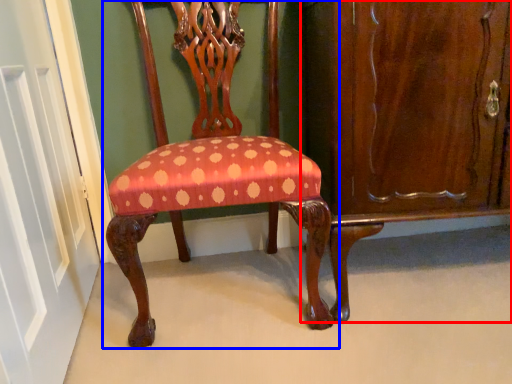
Question: Which point is further to the camera, dresser (highlighted by a red box) or chair (highlighted by a blue box)?

Choices:
 (A) dresser
 (B) chair

Answer: (A)